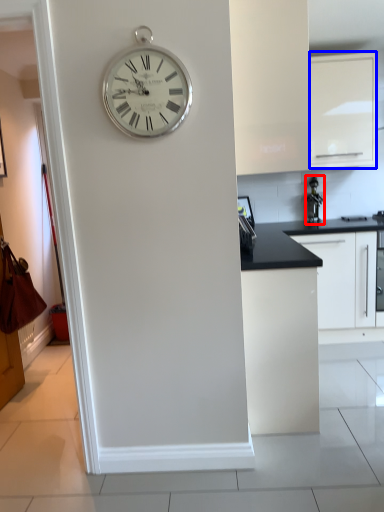
Question: Which object is further to the camera taking this photo, appliance (highlighted by a red box) or cabinetry (highlighted by a blue box)?

Choices:
 (A) appliance
 (B) cabinetry

Answer: (A)